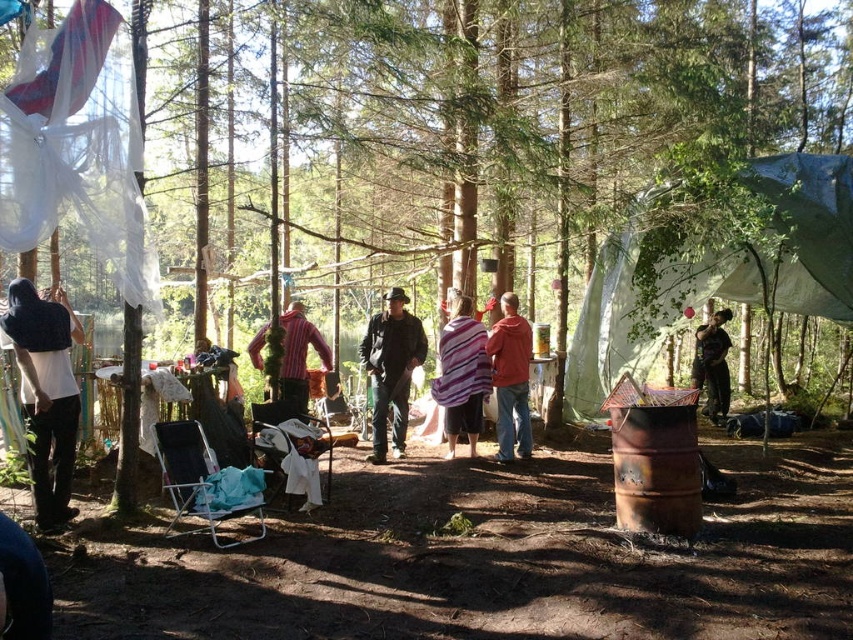
Question: Which object is the closest to the striped fabric shirt at center?

Choices:
 (A) striped shirt at center
 (B) dark blue sweater at left
 (C) matte red shirt at center
 (D) green tarpaulin tent at center-right

Answer: (A)

Question: Considering the real-world distances, which object is farthest from the dark blue sweater at left?

Choices:
 (A) green tarpaulin tent at center-right
 (B) matte black jacket at center
 (C) dark brown leather jacket at lower right

Answer: (C)

Question: Is striped fabric scarf at center further to camera compared to striped shirt at center?

Choices:
 (A) no
 (B) yes

Answer: (B)

Question: Which point appears farthest from the camera in this image?

Choices:
 (A) (277, 323)
 (B) (39, 413)

Answer: (A)

Question: Can you confirm if matte black jacket at center is positioned to the left of matte red shirt at center?

Choices:
 (A) no
 (B) yes

Answer: (B)

Question: Can you confirm if matte black jacket at center is positioned below dark brown leather jacket at lower right?

Choices:
 (A) no
 (B) yes

Answer: (A)